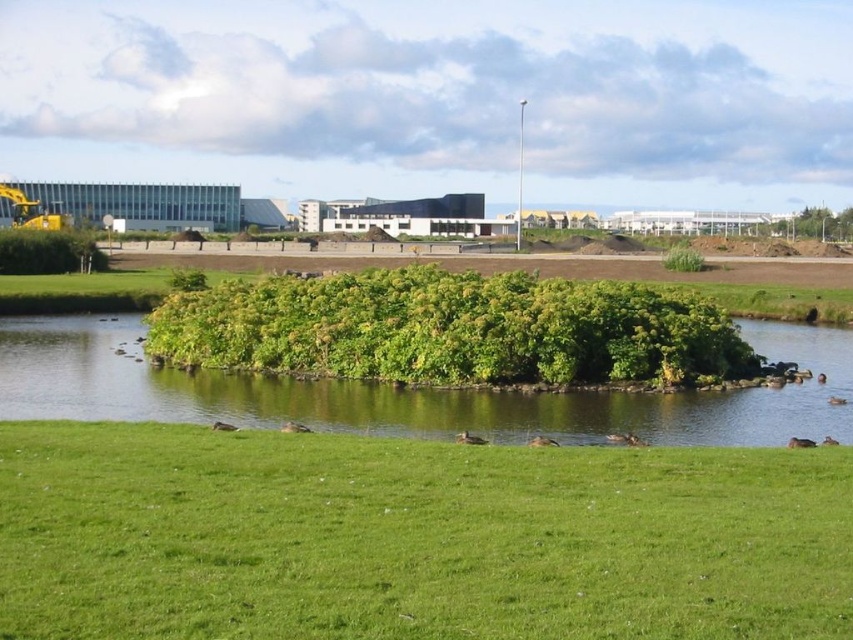
Question: Among these objects, which one is nearest to the camera?

Choices:
 (A) brown feathered duck at lower center
 (B) green grassy at lower center
 (C) brown fuzzy duck at lower center

Answer: (B)

Question: Is green leafy bush at upper right positioned in front of brown fuzzy duck at lower center?

Choices:
 (A) no
 (B) yes

Answer: (A)

Question: Which point is farther to the camera?

Choices:
 (A) green grassy at lower center
 (B) green leafy bush at center
 (C) brown fuzzy duck at lower center

Answer: (B)

Question: Is green leafy island at center above brown feathered duck at lower center?

Choices:
 (A) yes
 (B) no

Answer: (A)

Question: Does green leafy island at center lie in front of green leafy bush at upper right?

Choices:
 (A) yes
 (B) no

Answer: (A)

Question: Among these points, which one is farthest from the camera?

Choices:
 (A) (688, 365)
 (B) (799, 488)
 (C) (527, 444)

Answer: (A)